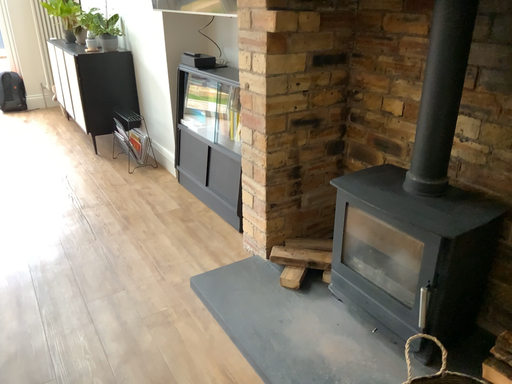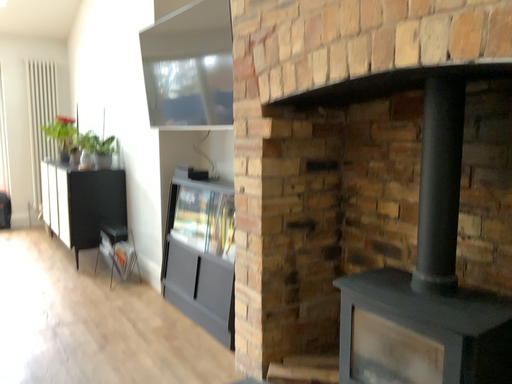
Question: How did the camera likely rotate when shooting the video?

Choices:
 (A) rotated downward
 (B) rotated upward

Answer: (B)